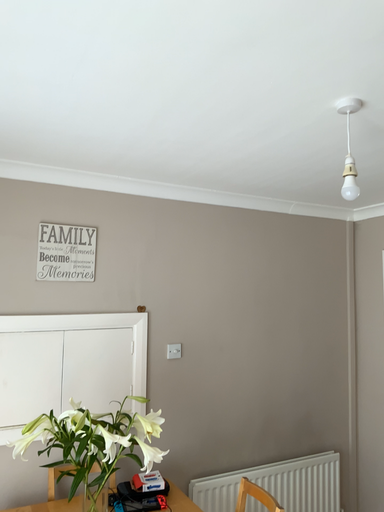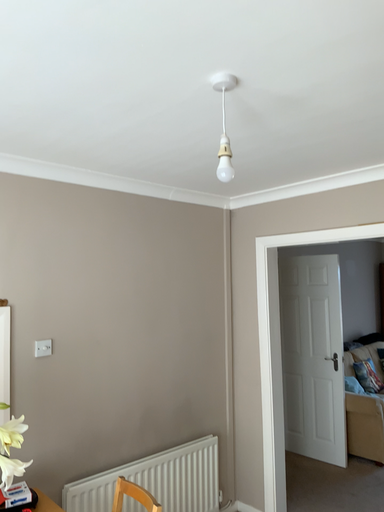
Question: How did the camera likely rotate when shooting the video?

Choices:
 (A) rotated right
 (B) rotated left

Answer: (A)